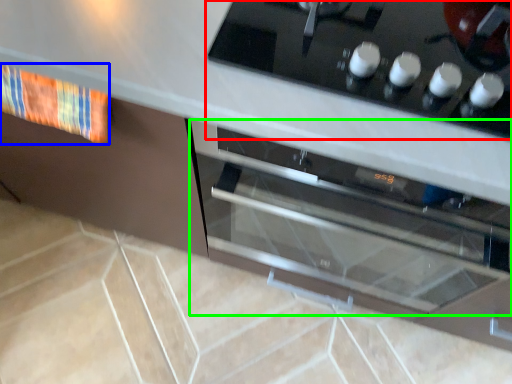
Question: Estimate the real-world distances between objects in this image. Which object is closer to home appliance (highlighted by a red box), material (highlighted by a blue box) or oven (highlighted by a green box)?

Choices:
 (A) material
 (B) oven

Answer: (B)